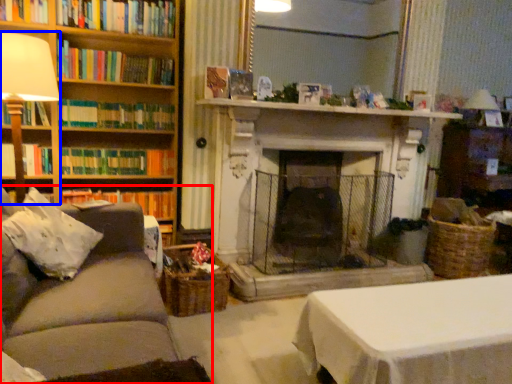
Question: Which object is further to the camera taking this photo, studio couch (highlighted by a red box) or table lamp (highlighted by a blue box)?

Choices:
 (A) studio couch
 (B) table lamp

Answer: (B)